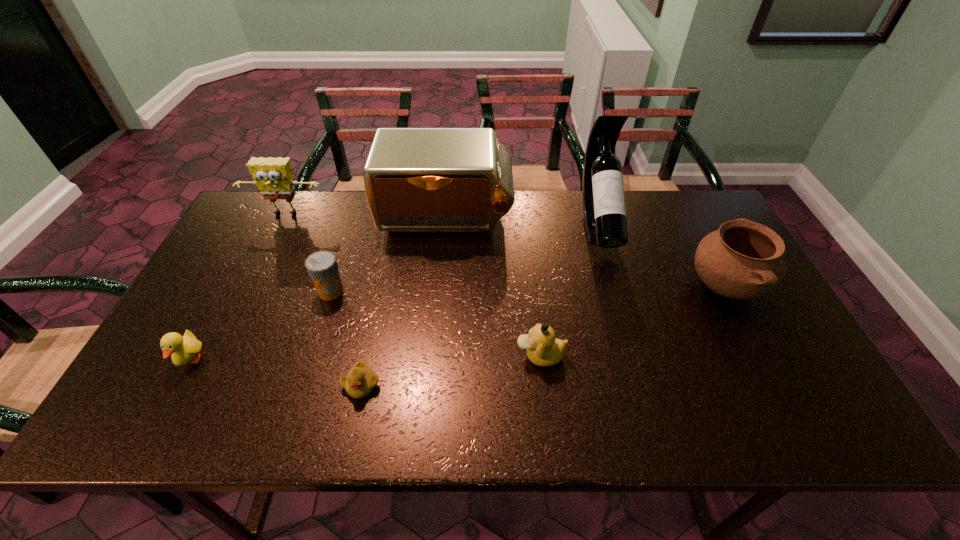
Find the location of a particular element. The width and height of the screenshot is (960, 540). the closest object to the toaster oven is located at coordinates (322, 267).

Locate which object ranks third in proximity to the leftmost duckling. Please provide its 2D coordinates. Your answer should be formatted as a tuple, i.e. [(x, y)], where the tuple contains the x and y coordinates of a point satisfying the conditions above.

[(273, 176)]

This screenshot has width=960, height=540. What are the coordinates of `duckling that stands as the closest to the rightmost object` in the screenshot? It's located at (543, 348).

You are a GUI agent. You are given a task and a screenshot of the screen. Output one action in this format:
    pyautogui.click(x=<x>, y=<y>)
    Task: Click on the duckling that stands as the closest to the third object from left to right
    
    Given the screenshot: What is the action you would take?
    pyautogui.click(x=360, y=381)

Identify the location of free space that satisfies the following two spatial constraints: 1. on the face of the rightmost duckling; 2. on the front-facing side of the leftmost duckling. (540, 361).

Where is `free space that satisfies the following two spatial constraints: 1. on the door side of the toaster oven; 2. on the right side of the pottery`? free space that satisfies the following two spatial constraints: 1. on the door side of the toaster oven; 2. on the right side of the pottery is located at coordinates (439, 287).